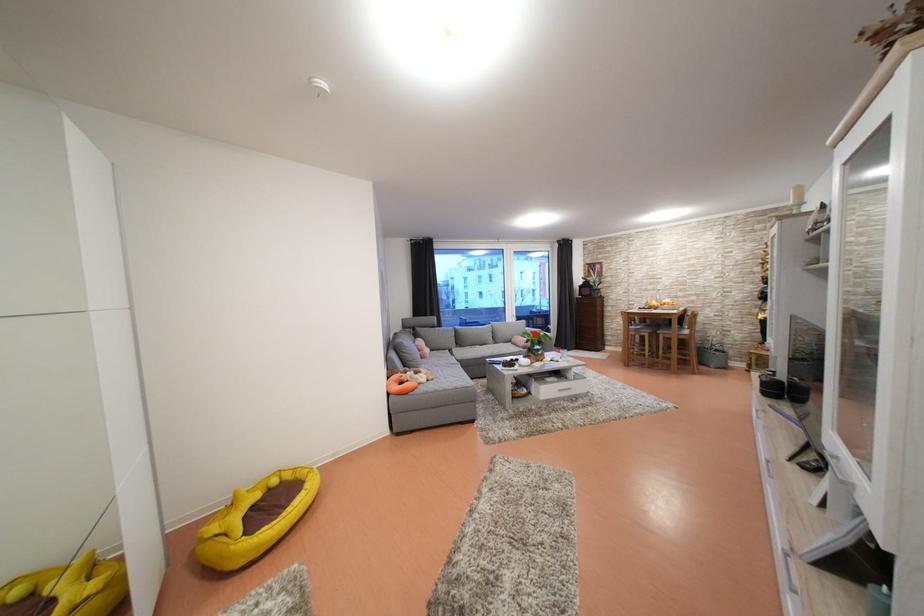
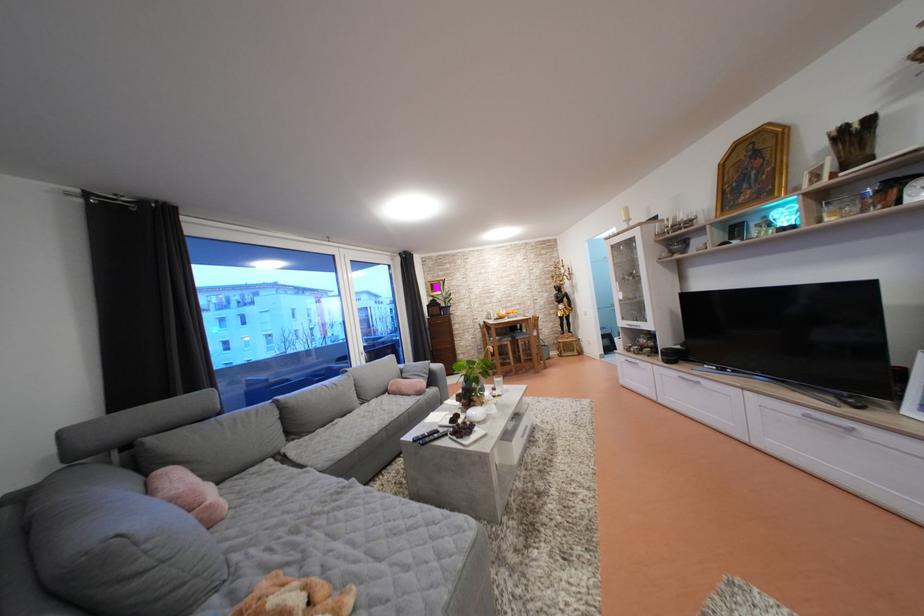
Locate, in the second image, the point that corresponds to the highlighted location in the first image.

(408, 371)